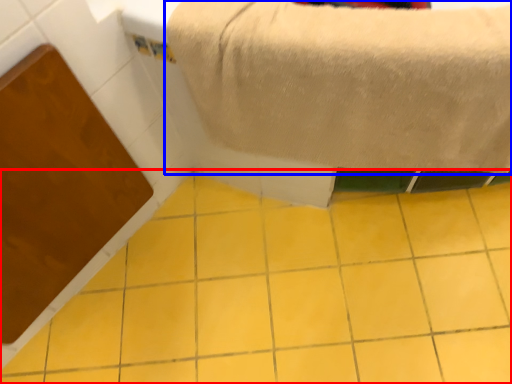
Question: Which point is further to the camera, ceramic tile (highlighted by a red box) or towel (highlighted by a blue box)?

Choices:
 (A) ceramic tile
 (B) towel

Answer: (A)